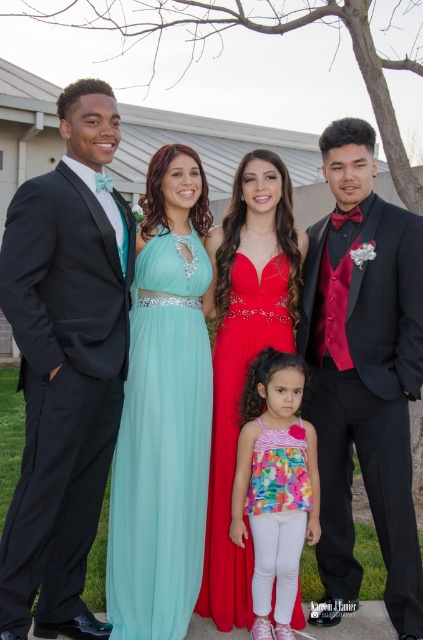
You are a photographer at a formal event. You need to arrange the floral fabric dress at center and the shiny red dress at center so that the shorter one is in front to avoid blocking the view. Which dress should be placed in front?

The floral fabric dress at center is not as tall as the shiny red dress at center, so the floral fabric dress at center should be placed in front to avoid blocking the view.

You are a photographer at a formal event. You need to capture a photo where the shiny black suit at left is clearly visible without being blocked by the shiny red dress at center. Based on their positions, can you position yourself in a way to achieve this?

The shiny black suit at left is positioned over the shiny red dress at center, so if you position yourself below the shiny black suit at left, you can ensure the shiny black suit at left is visible without obstruction from the shiny red dress at center.

You are standing in front of the group of people in the image. There are two points marked in the scene, one at coordinates point (57, 312) and another at point (205, 556). Which of these two points is closer to your current position?

Point (57, 312) is closer to the camera than point (205, 556), so the point at coordinates point (57, 312) is closer to your current position.